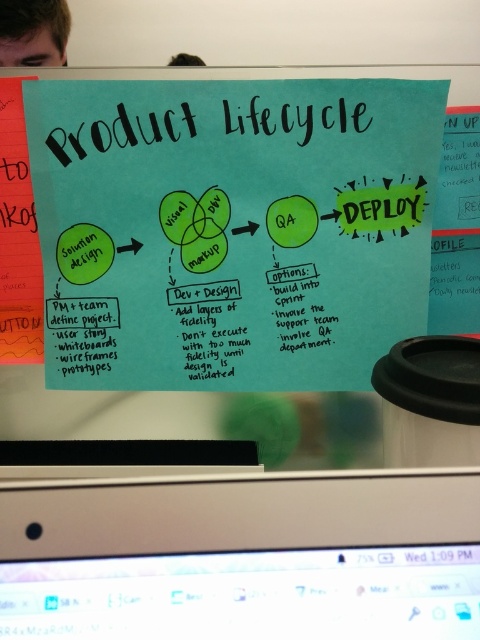
Question: Which of the following is the closest to the observer?

Choices:
 (A) (164, 193)
 (B) (252, 570)

Answer: (B)

Question: Does blue paper poster at center appear on the left side of black glossy computer monitor at bottom?

Choices:
 (A) yes
 (B) no

Answer: (A)

Question: Is blue paper poster at center wider than black glossy computer monitor at bottom?

Choices:
 (A) yes
 (B) no

Answer: (A)

Question: Which point is closer to the camera?

Choices:
 (A) blue paper poster at center
 (B) black glossy computer monitor at bottom

Answer: (B)

Question: Does blue paper poster at center lie behind black glossy computer monitor at bottom?

Choices:
 (A) no
 (B) yes

Answer: (B)

Question: Which of the following is the closest to the observer?

Choices:
 (A) blue paper poster at center
 (B) black glossy computer monitor at bottom

Answer: (B)